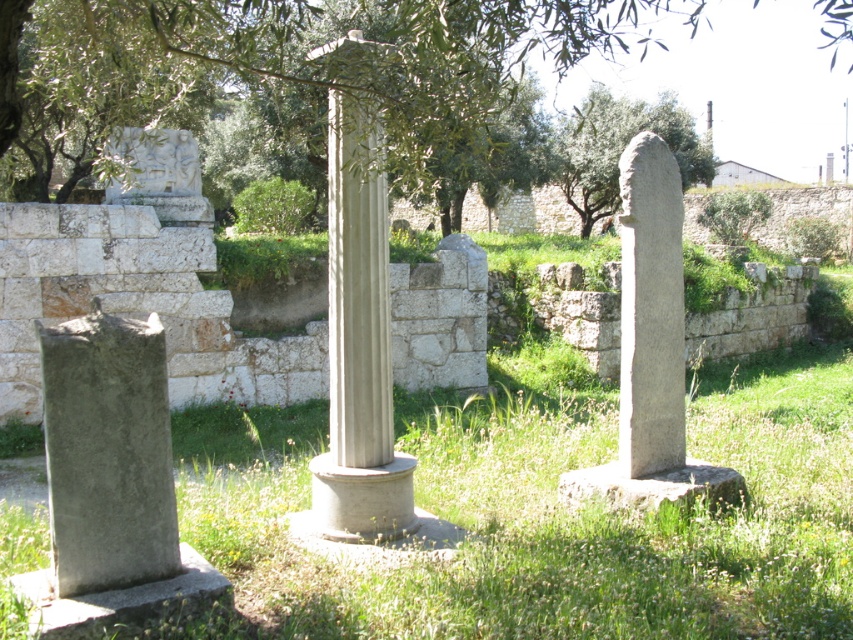
You are an archaeologist examining the site. You need to take a photo of the smooth stone column at center without the green leafy tree at upper center appearing in the frame. Is this possible given their positions?

The green leafy tree at upper center is to the right of the smooth stone column at center, so if you position yourself to the left side of the column and aim the camera away from the tree, you can capture the column without the tree in the frame.

You are standing at the archaeological site and want to reach the point marked as point (332, 449). If your walking distance is limited to 15 feet, can you reach it without moving further?

The point (332, 449) is 17.25 feet away from the camera, which exceeds your 15 feet limit. Therefore, you cannot reach it without moving further.

Consider the image. You are an archaeologist examining the site. You need to determine which object has a greater width between the green leafy tree at upper center and the smooth stone column at center. Based on your observations, which one is wider?

The green leafy tree at upper center is wider than the smooth stone column at center according to the description.